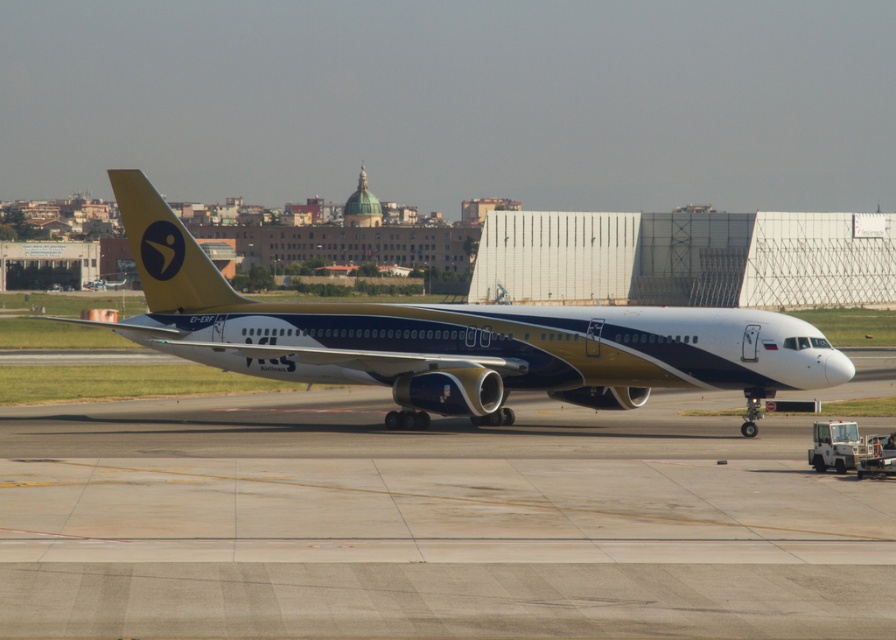
How distant is white/golden airplane at center from yellow matte airplane tail at upper left?

white/golden airplane at center and yellow matte airplane tail at upper left are 10.29 feet apart.

Between white/golden airplane at center and yellow matte airplane tail at upper left, which one is positioned lower?

white/golden airplane at center

Is point (174, 346) positioned in front of point (157, 211)?

Yes, it is.

The width and height of the screenshot is (896, 640). What are the coordinates of `white/golden airplane at center` in the screenshot? It's located at (455, 339).

Which is more to the right, smooth concrete tarmac at center or yellow matte airplane tail at upper left?

Positioned to the right is smooth concrete tarmac at center.

Which of these two, smooth concrete tarmac at center or yellow matte airplane tail at upper left, stands shorter?

smooth concrete tarmac at center is shorter.

Which is behind, point (511, 520) or point (171, 218)?

The point (171, 218) is more distant.

Where is `smooth concrete tarmac at center`? This screenshot has height=640, width=896. smooth concrete tarmac at center is located at coordinates (429, 522).

Is smooth concrete tarmac at center further to the viewer compared to white/golden airplane at center?

No.

Is smooth concrete tarmac at center closer to the viewer compared to white/golden airplane at center?

Yes, it is in front of white/golden airplane at center.

The width and height of the screenshot is (896, 640). What do you see at coordinates (429, 522) in the screenshot?
I see `smooth concrete tarmac at center` at bounding box center [429, 522].

Identify the location of smooth concrete tarmac at center. Image resolution: width=896 pixels, height=640 pixels. (429, 522).